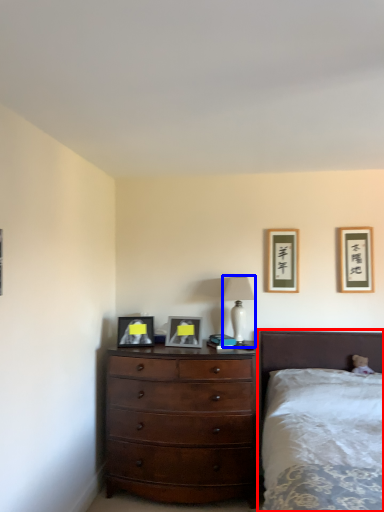
Question: Which object is closer to the camera taking this photo, bed (highlighted by a red box) or table lamp (highlighted by a blue box)?

Choices:
 (A) bed
 (B) table lamp

Answer: (A)